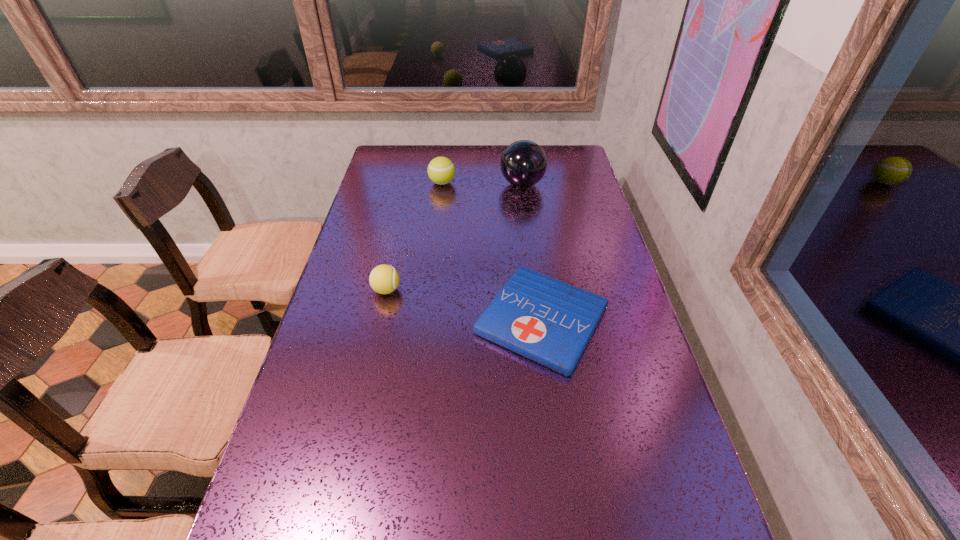
Identify the location of vacant region that satisfies the following two spatial constraints: 1. on the front side of the shortest object; 2. on the right side of the third shortest object. The image size is (960, 540). (426, 320).

Find the location of `free space that satisfies the following two spatial constraints: 1. on the side of the tallest object with the finger holes; 2. on the left side of the shortest object`. free space that satisfies the following two spatial constraints: 1. on the side of the tallest object with the finger holes; 2. on the left side of the shortest object is located at coordinates (540, 320).